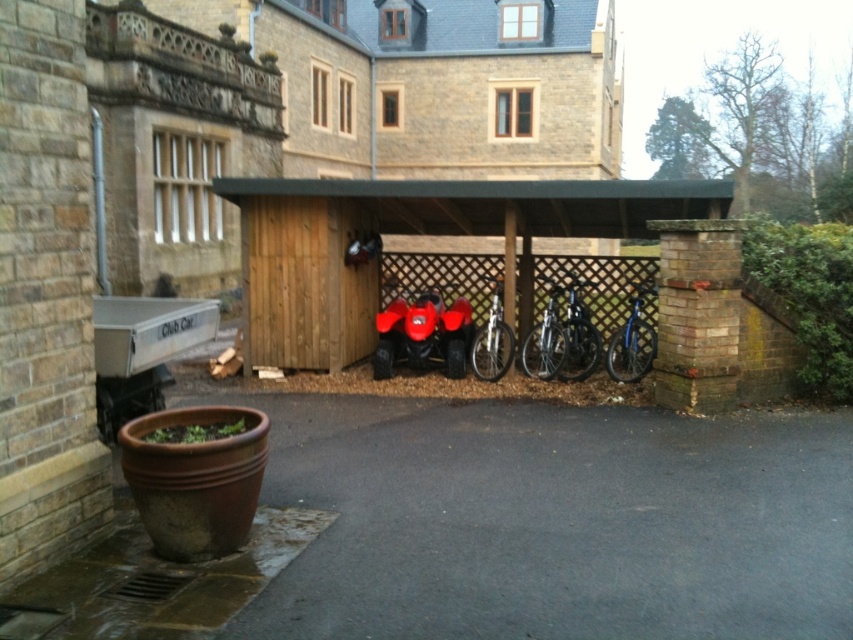
You are a delivery person who needs to park a 3.5 feet wide delivery cart between the wooden bike rack at center and the silver metallic bicycle at center. Is there enough space for the cart to fit between them?

The wooden bike rack at center and silver metallic bicycle at center are 5.22 feet apart from each other. Since the delivery cart is 3.5 feet wide, there is enough space between them to fit the cart.